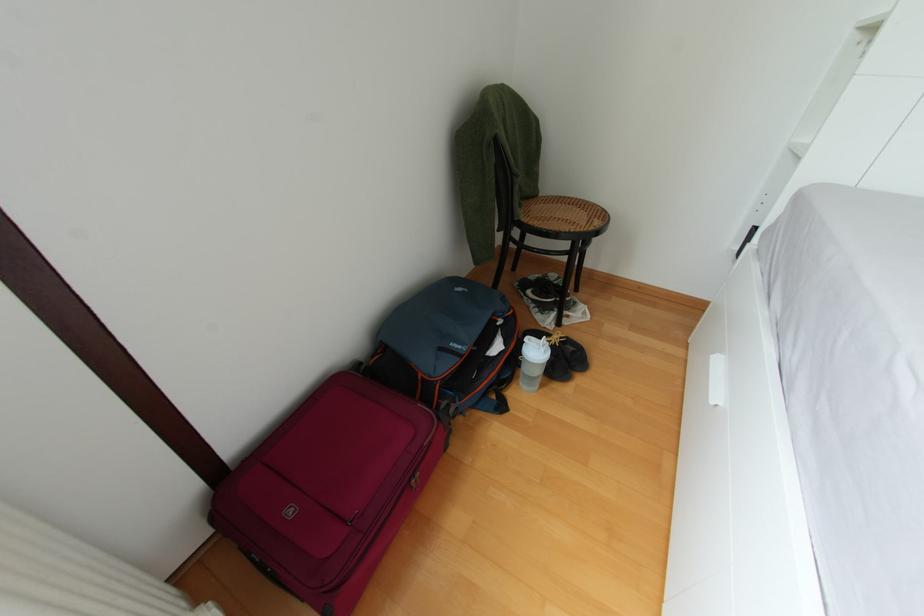
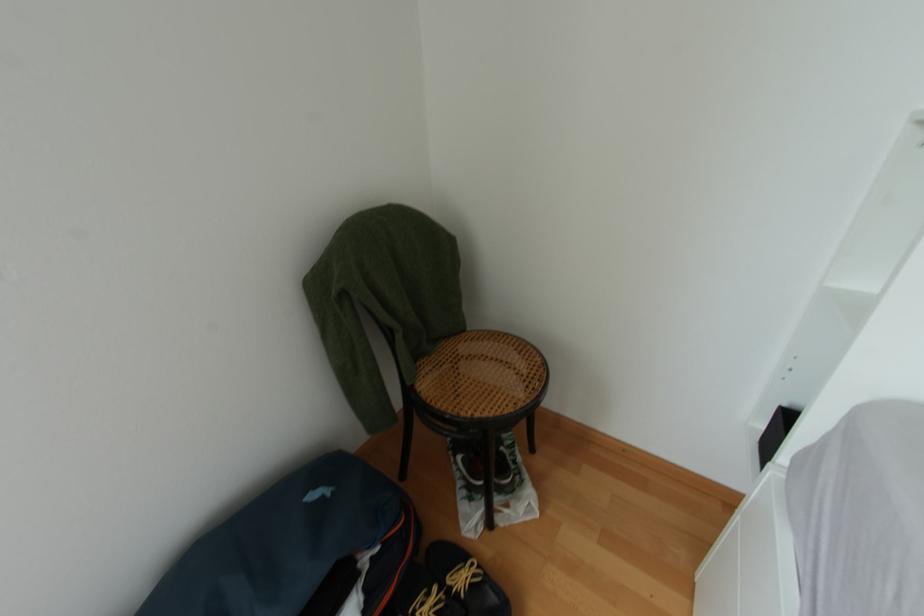
What movement of the cameraman would produce the second image?

The movement direction of the cameraman is right, forward.